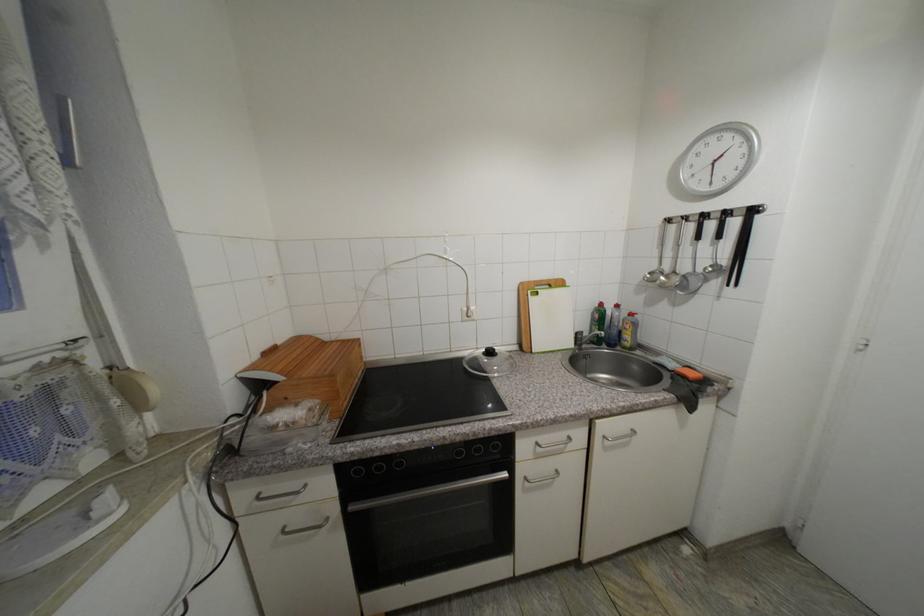
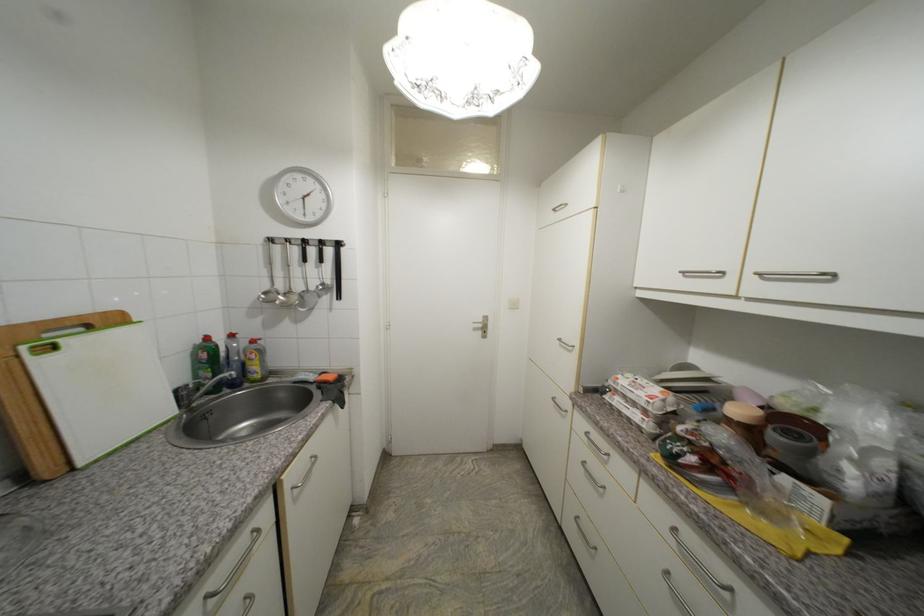
Locate, in the second image, the point that corresponds to the point at 535,293 in the first image.

(30, 349)